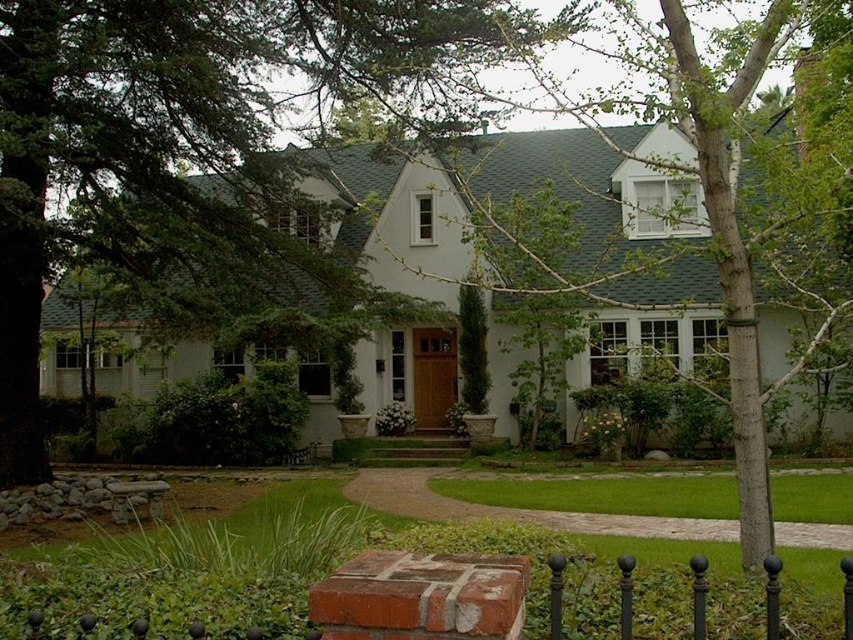
Can you confirm if green leafy tree at center is smaller than green grass at center?

No.

Does green leafy tree at center lie in front of green grass at center?

Yes, green leafy tree at center is closer to the viewer.

Identify the location of green leafy tree at center. (193, 145).

You are a GUI agent. You are given a task and a screenshot of the screen. Output one action in this format:
    pyautogui.click(x=<x>, y=<y>)
    Task: Click on the green leafy tree at center
    
    Given the screenshot: What is the action you would take?
    pyautogui.click(x=193, y=145)

Who is positioned more to the left, green leafy tree at center or smooth bark tree at center?

Positioned to the left is green leafy tree at center.

Describe the element at coordinates (193, 145) in the screenshot. This screenshot has height=640, width=853. I see `green leafy tree at center` at that location.

The width and height of the screenshot is (853, 640). What are the coordinates of `green leafy tree at center` in the screenshot? It's located at (193, 145).

This screenshot has width=853, height=640. I want to click on smooth bark tree at center, so [x=741, y=179].

Between point (740, 60) and point (712, 502), which one is positioned behind?

The point (712, 502) is behind.

This screenshot has height=640, width=853. I want to click on smooth bark tree at center, so tap(741, 179).